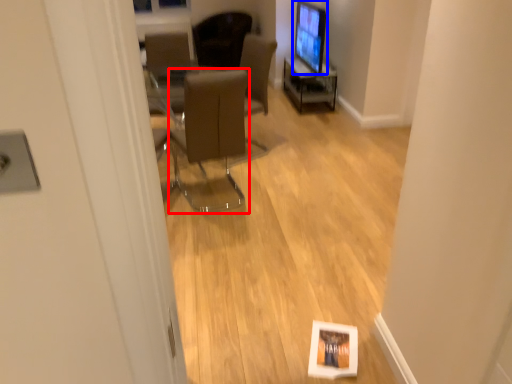
Question: Which object is further to the camera taking this photo, chair (highlighted by a red box) or computer monitor (highlighted by a blue box)?

Choices:
 (A) chair
 (B) computer monitor

Answer: (B)